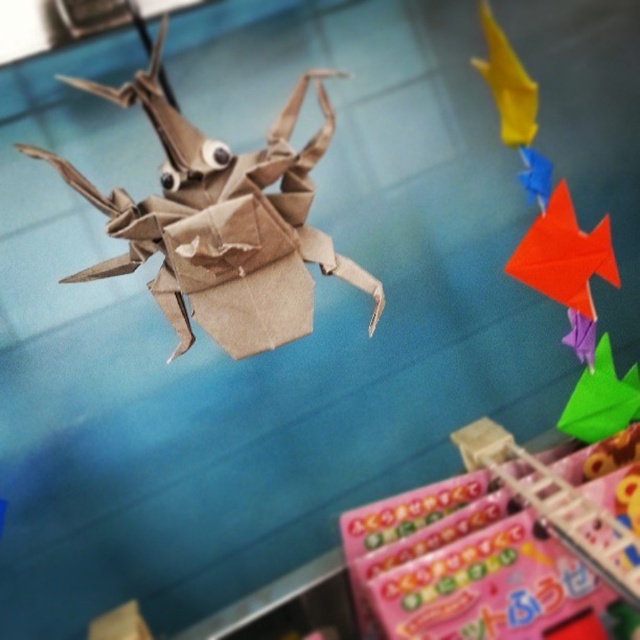
Is point (144, 237) positioned before point (529, 90)?

Yes.

Who is shorter, brown paper origami crab at center or yellow paper fish at upper right?

Standing shorter between the two is yellow paper fish at upper right.

Which is behind, point (337, 268) or point (508, 52)?

The point (508, 52) is more distant.

Locate an element on the screen. The width and height of the screenshot is (640, 640). brown paper origami crab at center is located at coordinates (221, 221).

Locate an element on the screen. Image resolution: width=640 pixels, height=640 pixels. orange paper fish at upper right is located at coordinates (566, 266).

From the picture: Does orange paper fish at upper right appear on the left side of yellow paper fish at upper right?

Incorrect, orange paper fish at upper right is not on the left side of yellow paper fish at upper right.

What do you see at coordinates (566, 266) in the screenshot? The image size is (640, 640). I see `orange paper fish at upper right` at bounding box center [566, 266].

Find the location of `orange paper fish at upper right`. orange paper fish at upper right is located at coordinates (566, 266).

Can you confirm if brown paper origami crab at center is smaller than orange paper fish at upper right?

Actually, brown paper origami crab at center might be larger than orange paper fish at upper right.

Measure the distance between brown paper origami crab at center and camera.

brown paper origami crab at center and camera are 31.87 inches apart.

At what (x,y) coordinates should I click in order to perform the action: click on brown paper origami crab at center. Please return your answer as a coordinate pair (x, y). Looking at the image, I should click on (221, 221).